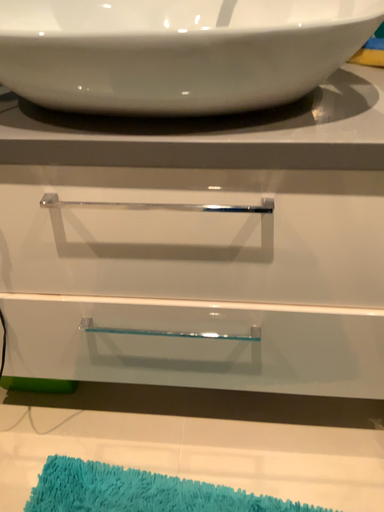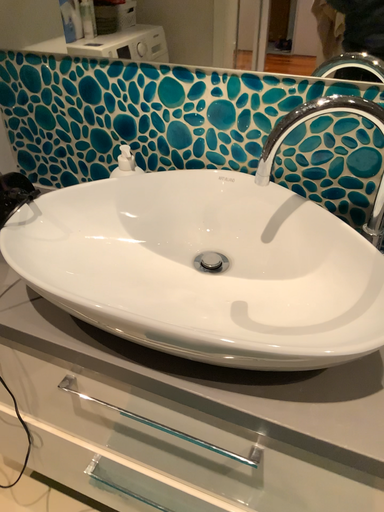
Question: How did the camera likely rotate when shooting the video?

Choices:
 (A) rotated right
 (B) rotated left

Answer: (B)